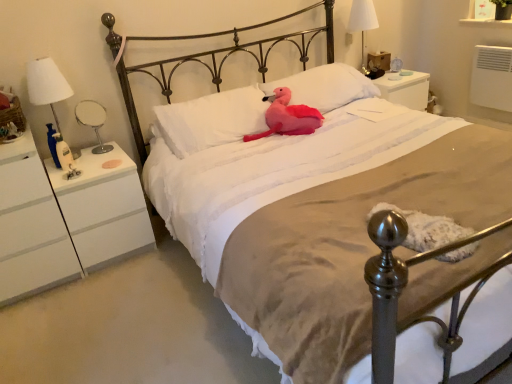
Question: From the image's perspective, is pink plush toy at center located beneath white soft pillow at center, which is counted as the second pillow, starting from the right?

Choices:
 (A) yes
 (B) no

Answer: (B)

Question: Can you confirm if pink plush toy at center is taller than white soft pillow at center, which is the first pillow in left-to-right order?

Choices:
 (A) yes
 (B) no

Answer: (B)

Question: Does pink plush toy at center appear on the left side of white soft pillow at center, which is counted as the second pillow, starting from the right?

Choices:
 (A) yes
 (B) no

Answer: (B)

Question: From a real-world perspective, is pink plush toy at center below white soft pillow at center, which is counted as the second pillow, starting from the right?

Choices:
 (A) yes
 (B) no

Answer: (A)

Question: From the image's perspective, does pink plush toy at center appear higher than white soft pillow at center, which is counted as the second pillow, starting from the right?

Choices:
 (A) no
 (B) yes

Answer: (B)

Question: Is white matte nightstand at left taller or shorter than white soft pillow at center, the second pillow in the left-to-right sequence?

Choices:
 (A) short
 (B) tall

Answer: (B)

Question: Is white matte nightstand at left wider or thinner than white soft pillow at center, which is the 1th pillow from right to left?

Choices:
 (A) thin
 (B) wide

Answer: (B)

Question: Based on their sizes in the image, would you say white matte nightstand at left is bigger or smaller than white soft pillow at center, which is the 1th pillow from right to left?

Choices:
 (A) big
 (B) small

Answer: (A)

Question: Is white matte nightstand at left inside the boundaries of white soft pillow at center, which is the 1th pillow from right to left, or outside?

Choices:
 (A) outside
 (B) inside

Answer: (A)

Question: In terms of height, does white fabric lampshade at upper right, which ranks as the 1th bedside lamp in back-to-front order, look taller or shorter compared to white fabric lampshade at left, the third bedside lamp viewed from the right?

Choices:
 (A) short
 (B) tall

Answer: (B)

Question: Considering their positions, is white fabric lampshade at upper right, marked as the first bedside lamp in a right-to-left arrangement, located in front of or behind white fabric lampshade at left, acting as the 3th bedside lamp starting from the back?

Choices:
 (A) front
 (B) behind

Answer: (B)

Question: Looking at the image, does white fabric lampshade at upper right, marked as the 3th bedside lamp in a bottom-to-top arrangement, seem bigger or smaller compared to white fabric lampshade at left, the 1th bedside lamp viewed from the front?

Choices:
 (A) big
 (B) small

Answer: (B)

Question: Is white fabric lampshade at upper right, the third bedside lamp in the left-to-right sequence, wider or thinner than white fabric lampshade at left, the 1th bedside lamp viewed from the front?

Choices:
 (A) thin
 (B) wide

Answer: (A)

Question: Considering the relative positions of white soft pillow at center, which is the 1th pillow from right to left, and pink plush toy at center in the image provided, is white soft pillow at center, which is the 1th pillow from right to left, to the left or to the right of pink plush toy at center?

Choices:
 (A) left
 (B) right

Answer: (B)

Question: Looking at their shapes, would you say white soft pillow at center, which is the 1th pillow from right to left, is wider or thinner than pink plush toy at center?

Choices:
 (A) wide
 (B) thin

Answer: (B)